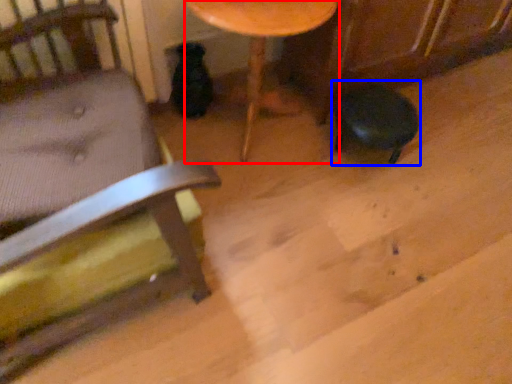
Question: Which object appears closest to the camera in this image, table (highlighted by a red box) or bar stool (highlighted by a blue box)?

Choices:
 (A) table
 (B) bar stool

Answer: (A)